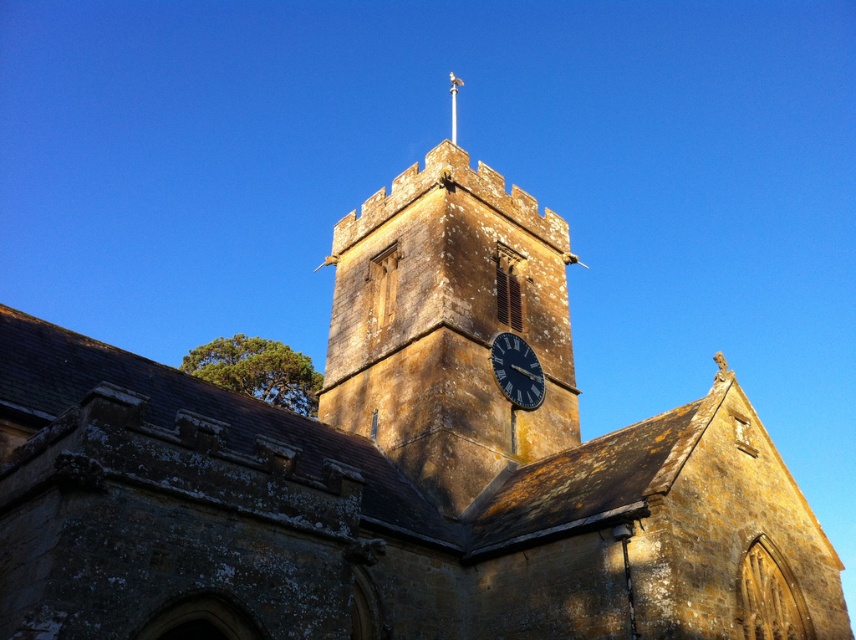
Is point (497, 346) more distant than point (450, 86)?

No, (497, 346) is closer to viewer.

This screenshot has height=640, width=856. I want to click on dark blue glass clock at center, so click(x=516, y=371).

Measure the distance between point [431,454] and camera.

Point [431,454] is 41.26 meters from camera.

Does point (432, 262) lie in front of point (455, 97)?

Yes, point (432, 262) is closer to viewer.

The image size is (856, 640). Find the location of `yellow stone clock tower at center`. yellow stone clock tower at center is located at coordinates (449, 324).

Which of these two, yellow stone clock tower at center or dark blue glass clock at center, stands shorter?

dark blue glass clock at center is shorter.

Is yellow stone clock tower at center behind dark blue glass clock at center?

No, it is not.

Image resolution: width=856 pixels, height=640 pixels. Describe the element at coordinates (449, 324) in the screenshot. I see `yellow stone clock tower at center` at that location.

I want to click on yellow stone clock tower at center, so click(449, 324).